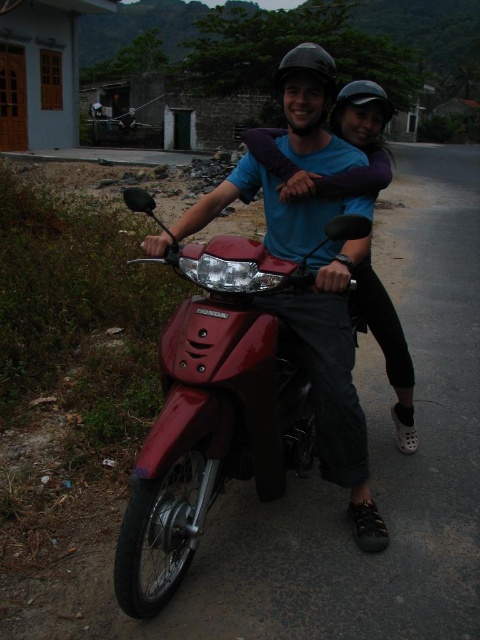
You are a photographer trying to capture a photo of the glossy red motorcycle at center and the matte purple shirt at center. From the perspective of the photographer standing in front of the scene, which object is located to the left?

The glossy red motorcycle at center is positioned on the left side of matte purple shirt at center, so from the photographer standing in front of the scene, the glossy red motorcycle at center is to the left of the matte purple shirt at center.

You are a photographer trying to capture the glossy red motorcycle at center and the matte purple shirt at center in a single shot. Based on their positions, which object is closer to the camera?

The glossy red motorcycle at center is positioned under the matte purple shirt at center, so the matte purple shirt at center is closer to the camera.